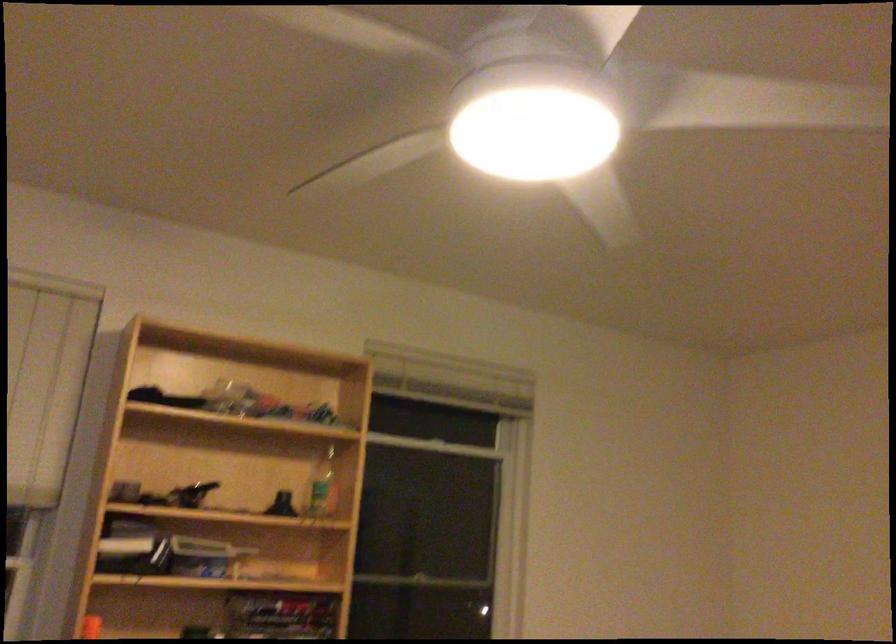
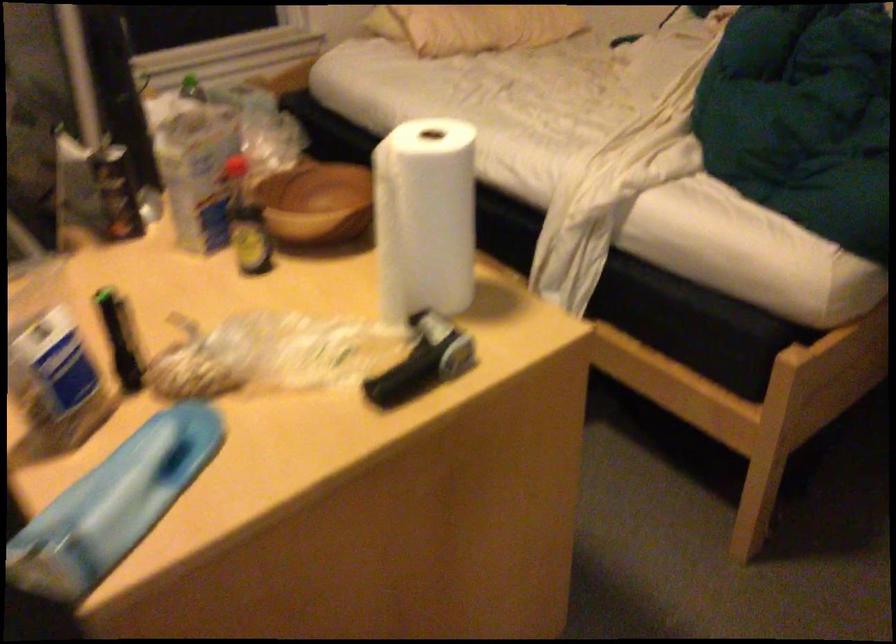
Question: The images are taken continuously from a first-person perspective. In which direction is your viewpoint rotating?

Choices:
 (A) Left
 (B) Right
 (C) Up
 (D) Down

Answer: (D)